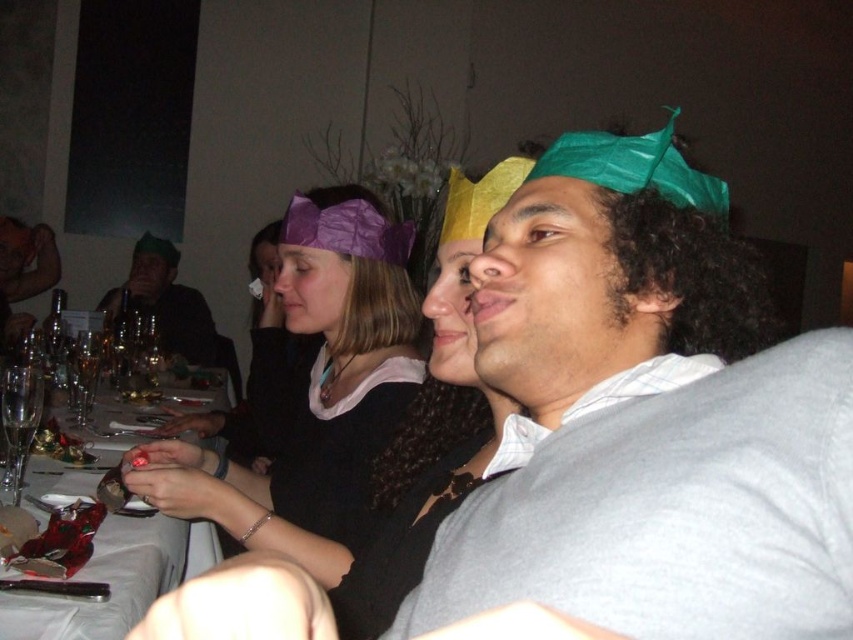
Question: Which point is farther to the camera?

Choices:
 (A) shiny silver spoon at left
 (B) clear glass wine glass at lower left

Answer: (B)

Question: Where is shiny silver spoon at left located in relation to matte purple paper crown at upper center in the image?

Choices:
 (A) left
 (B) right

Answer: (B)

Question: Does purple paper crown at upper center appear on the right side of matte purple paper crown at upper center?

Choices:
 (A) no
 (B) yes

Answer: (B)

Question: Is green paper crown at center wider than purple paper crown at upper center?

Choices:
 (A) no
 (B) yes

Answer: (A)

Question: Which object appears farthest from the camera in this image?

Choices:
 (A) shiny silver spoon at left
 (B) green paper crown at center
 (C) purple paper crown at upper center

Answer: (A)

Question: Which of these objects is positioned farthest from the purple paper crown at upper center?

Choices:
 (A) clear glass wine glass at left
 (B) matte purple paper crown at upper center
 (C) green paper crown at center
 (D) shiny silver spoon at left

Answer: (B)